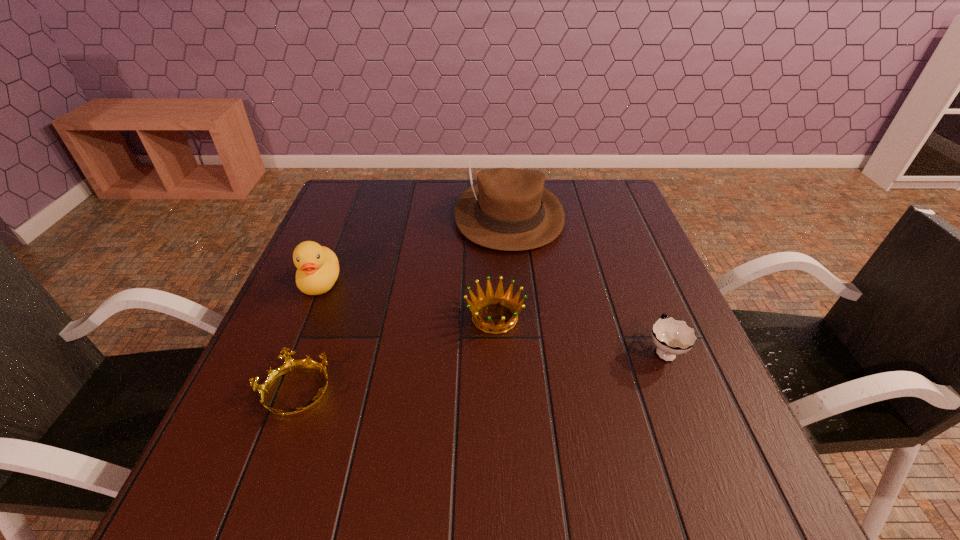
Find the location of a particular element. Image resolution: width=960 pixels, height=540 pixels. blank space located on the side of the cup with the handle is located at coordinates (637, 285).

You are a GUI agent. You are given a task and a screenshot of the screen. Output one action in this format:
    pyautogui.click(x=<x>, y=<y>)
    Task: Click on the blank space located 0.290m on the side of the cup with the handle
    Image resolution: width=960 pixels, height=540 pixels.
    Given the screenshot: What is the action you would take?
    pyautogui.click(x=624, y=250)

Locate an element on the screen. Image resolution: width=960 pixels, height=540 pixels. vacant region located 0.080m on the side of the cup with the handle is located at coordinates (646, 305).

This screenshot has height=540, width=960. In order to click on vacant area situated 0.180m on the front of the farther crown in this screenshot , I will do `click(498, 415)`.

At what (x,y) coordinates should I click in order to perform the action: click on vacant space located on the back of the shorter crown. Please return your answer as a coordinate pair (x, y). The height and width of the screenshot is (540, 960). Looking at the image, I should click on (347, 255).

Where is `object present at the far edge`? object present at the far edge is located at coordinates (509, 209).

Where is `duck that is at the left edge`? duck that is at the left edge is located at coordinates (318, 268).

Locate an element on the screen. This screenshot has width=960, height=540. crown that is positioned at the left edge is located at coordinates (290, 365).

Locate an element on the screen. The width and height of the screenshot is (960, 540). object at the right edge is located at coordinates (672, 337).

Locate an element on the screen. The width and height of the screenshot is (960, 540). free region at the far edge is located at coordinates (400, 193).